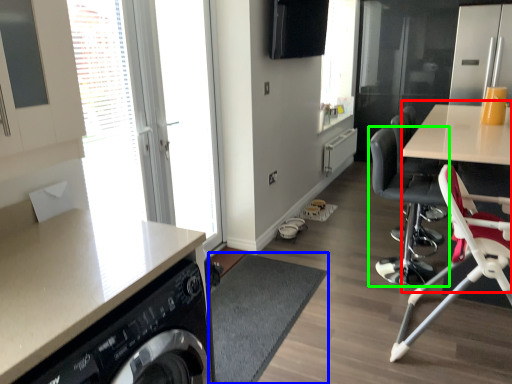
Question: Considering the real-world distances, which object is closest to computer desk (highlighted by a red box)? flat (highlighted by a blue box) or chair (highlighted by a green box).

Choices:
 (A) flat
 (B) chair

Answer: (B)